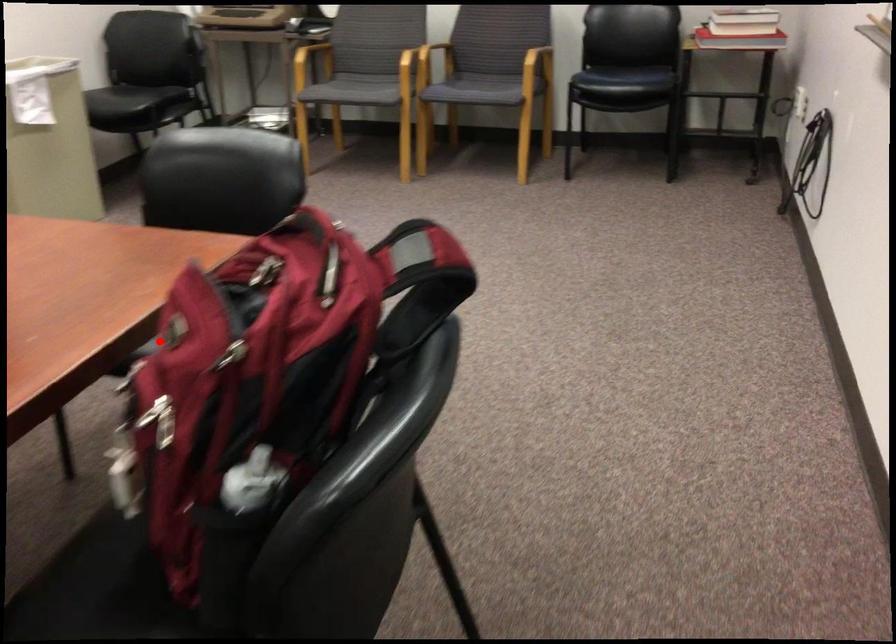
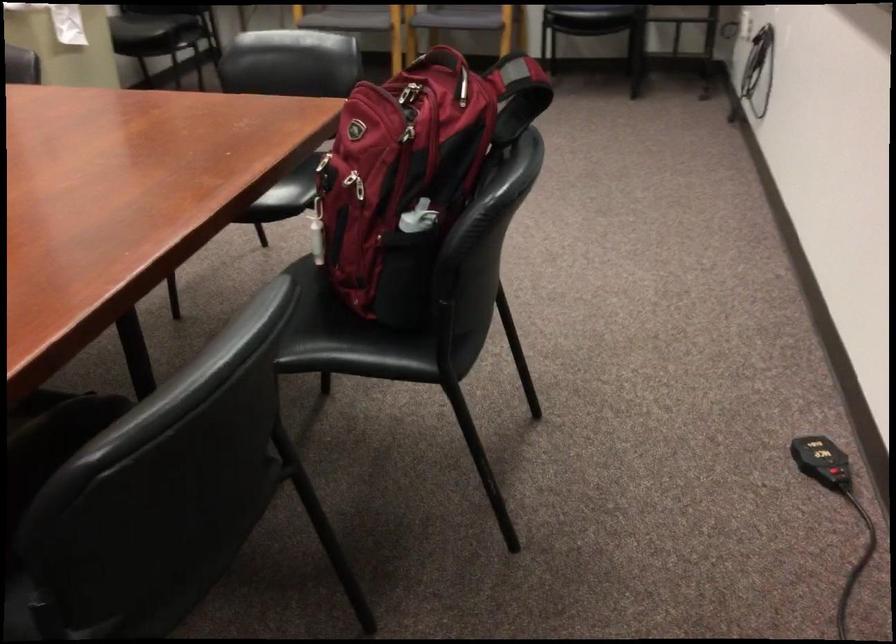
Locate, in the second image, the point that corresponds to the highlighted location in the first image.

(314, 153)